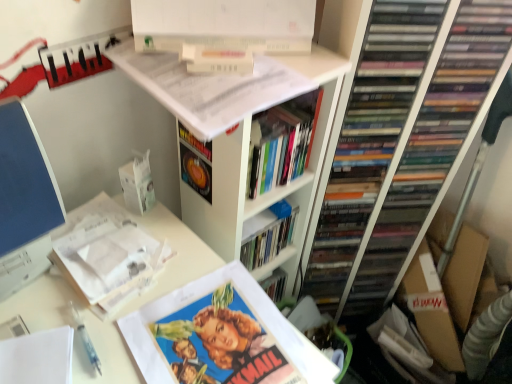
Question: Which direction should I rotate to look at white matte book at upper center, positioned as the fourth book in bottom-to-top order, — up or down?

Choices:
 (A) down
 (B) up

Answer: (B)

Question: Is white matte book at upper center, marked as the 1th book in a top-to-bottom arrangement, not within white matte bookshelf at upper center?

Choices:
 (A) yes
 (B) no

Answer: (A)

Question: Is white matte book at upper center, positioned as the fourth book in bottom-to-top order, wider than white matte bookshelf at upper center?

Choices:
 (A) yes
 (B) no

Answer: (B)

Question: Considering the relative sizes of white matte book at upper center, positioned as the fourth book in bottom-to-top order, and white matte bookshelf at upper center in the image provided, is white matte book at upper center, positioned as the fourth book in bottom-to-top order, shorter than white matte bookshelf at upper center?

Choices:
 (A) no
 (B) yes

Answer: (B)

Question: Does white matte book at upper center, marked as the 1th book in a top-to-bottom arrangement, come in front of white matte bookshelf at upper center?

Choices:
 (A) no
 (B) yes

Answer: (A)

Question: Is white matte book at upper center, positioned as the fourth book in bottom-to-top order, positioned behind white matte bookshelf at upper center?

Choices:
 (A) no
 (B) yes

Answer: (B)

Question: Considering the relative sizes of white matte book at upper center, positioned as the fourth book in bottom-to-top order, and white matte bookshelf at upper center in the image provided, is white matte book at upper center, positioned as the fourth book in bottom-to-top order, smaller than white matte bookshelf at upper center?

Choices:
 (A) yes
 (B) no

Answer: (A)

Question: Considering the relative sizes of hardcover book at center, positioned as the second book in top-to-bottom order, and white matte book at upper center, positioned as the fourth book in bottom-to-top order, in the image provided, is hardcover book at center, positioned as the second book in top-to-bottom order, shorter than white matte book at upper center, positioned as the fourth book in bottom-to-top order,?

Choices:
 (A) no
 (B) yes

Answer: (A)

Question: From the image's perspective, is hardcover book at center, placed as the third book when sorted from bottom to top, below white matte book at upper center, marked as the 1th book in a top-to-bottom arrangement?

Choices:
 (A) no
 (B) yes

Answer: (B)

Question: Is hardcover book at center, positioned as the second book in top-to-bottom order, bigger than white matte book at upper center, marked as the 1th book in a top-to-bottom arrangement?

Choices:
 (A) no
 (B) yes

Answer: (B)

Question: From a real-world perspective, is hardcover book at center, placed as the third book when sorted from bottom to top, located higher than white matte book at upper center, marked as the 1th book in a top-to-bottom arrangement?

Choices:
 (A) yes
 (B) no

Answer: (B)

Question: From the image's perspective, would you say hardcover book at center, positioned as the second book in top-to-bottom order, is positioned over white matte book at upper center, positioned as the fourth book in bottom-to-top order?

Choices:
 (A) yes
 (B) no

Answer: (B)

Question: Does hardcover book at center, placed as the third book when sorted from bottom to top, have a greater height compared to white matte book at upper center, marked as the 1th book in a top-to-bottom arrangement?

Choices:
 (A) yes
 (B) no

Answer: (A)

Question: Considering the relative sizes of white matte bookshelf at upper center and hardcover book at center, placed as the third book when sorted from bottom to top, in the image provided, is white matte bookshelf at upper center bigger than hardcover book at center, placed as the third book when sorted from bottom to top,?

Choices:
 (A) yes
 (B) no

Answer: (A)